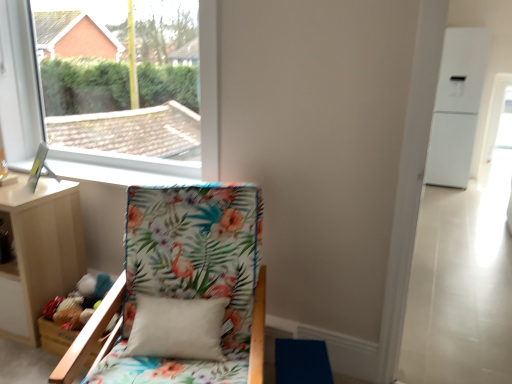
Question: From a real-world perspective, relative to white plastic window at upper left, is light wood nightstand at lower left vertically above or below?

Choices:
 (A) above
 (B) below

Answer: (B)

Question: Looking at the image, does light wood nightstand at lower left seem bigger or smaller compared to white plastic window at upper left?

Choices:
 (A) small
 (B) big

Answer: (A)

Question: Estimate the real-world distances between objects in this image. Which object is closer to the floral fabric chair at lower left?

Choices:
 (A) white plastic window at upper left
 (B) light wood nightstand at lower left

Answer: (B)

Question: Estimate the real-world distances between objects in this image. Which object is farther from the white plastic window at upper left?

Choices:
 (A) floral fabric chair at lower left
 (B) light wood nightstand at lower left

Answer: (A)